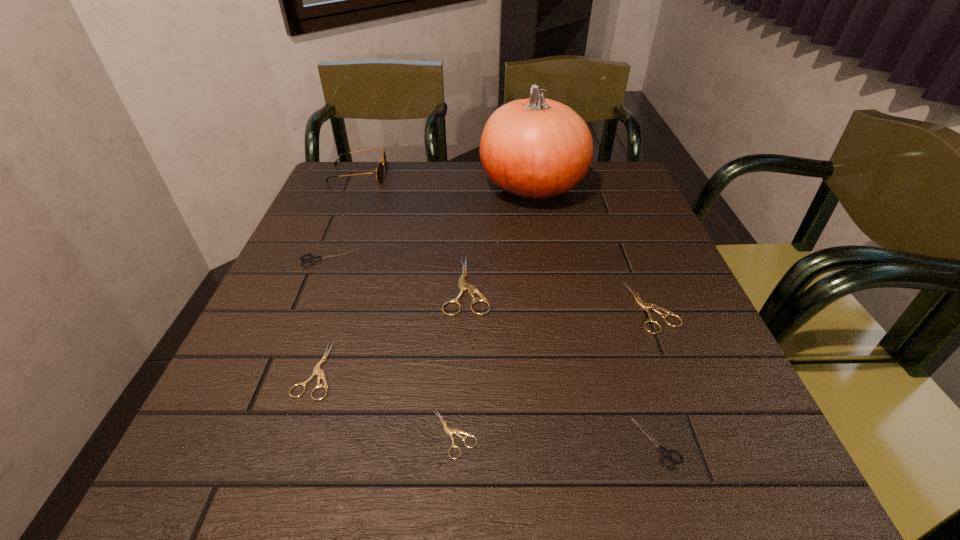
I want to click on free location located on the back of the right black shears, so click(x=612, y=297).

This screenshot has width=960, height=540. Find the location of `vacant space located on the right of the shortest object`. vacant space located on the right of the shortest object is located at coordinates (654, 434).

Locate an element on the screen. This screenshot has height=540, width=960. pumpkin at the far edge is located at coordinates (536, 149).

Identify the location of sunglasses at the far edge. This screenshot has height=540, width=960. (379, 170).

Locate an element on the screen. This screenshot has width=960, height=540. sunglasses that is at the left edge is located at coordinates (379, 170).

Find the location of `pumpkin present at the right edge`. pumpkin present at the right edge is located at coordinates (536, 149).

Image resolution: width=960 pixels, height=540 pixels. In order to click on object located in the far left corner section of the desktop in this screenshot , I will do `click(379, 170)`.

The image size is (960, 540). In order to click on object located at the far right corner in this screenshot , I will do `click(536, 149)`.

At what (x,y) coordinates should I click in order to perform the action: click on object at the near right corner. Please return your answer as a coordinate pair (x, y). The image size is (960, 540). Looking at the image, I should click on coord(666,453).

Image resolution: width=960 pixels, height=540 pixels. In order to click on vacant space at the far edge of the desktop in this screenshot , I will do `click(540, 207)`.